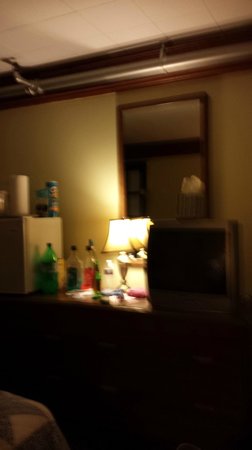
The image size is (252, 450). Find the location of `bottles`. bottles is located at coordinates (51, 267), (75, 266), (88, 269).